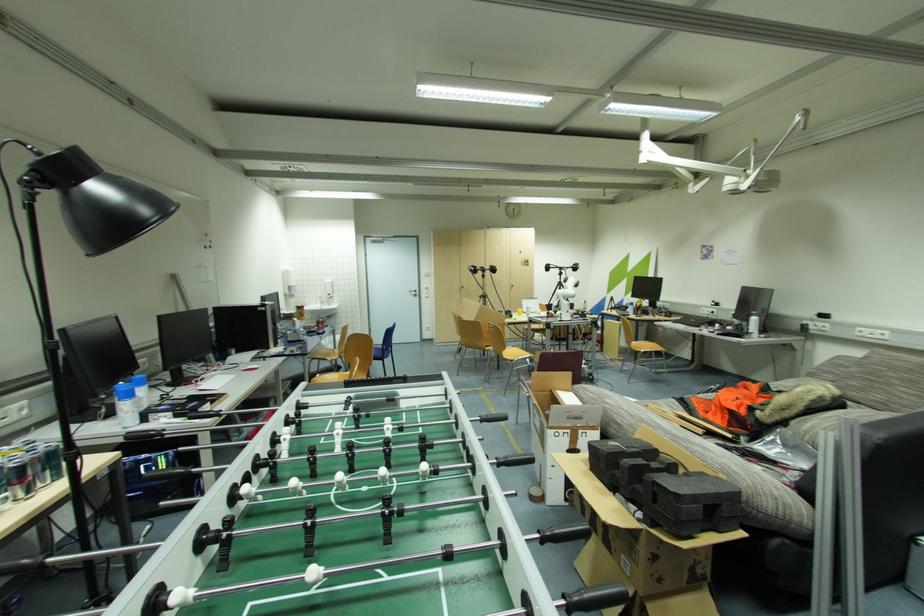
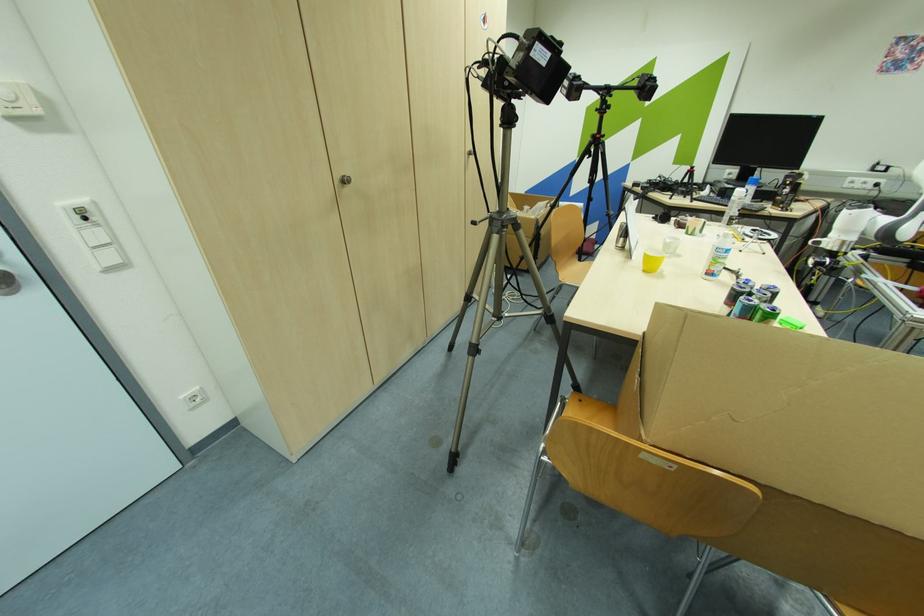
In the second image, find the point that corresponds to the point at 466,288 in the first image.

(348, 182)